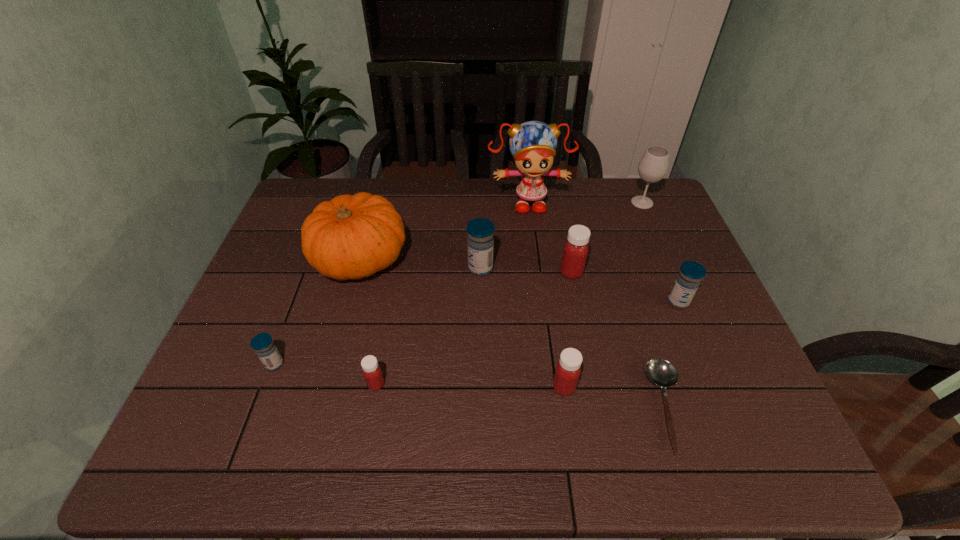
Locate an element on the screen. The image size is (960, 540). vacant area situated 0.060m on the back of the fourth medicine from right to left is located at coordinates (480, 245).

Locate an element on the screen. The image size is (960, 540). free point located on the front of the fifth medicine from left to right is located at coordinates (585, 341).

I want to click on blank area located 0.090m on the left of the fourth nearest medicine, so click(633, 301).

Locate an element on the screen. blank space located on the right of the third medicine from right to left is located at coordinates (719, 387).

The image size is (960, 540). Find the location of `vacant space located 0.300m on the right of the leftmost blue medicine`. vacant space located 0.300m on the right of the leftmost blue medicine is located at coordinates (413, 364).

Locate an element on the screen. The width and height of the screenshot is (960, 540). vacant space located 0.150m on the front of the second medicine from left to right is located at coordinates (362, 461).

This screenshot has height=540, width=960. What are the coordinates of `blank space located on the left of the gray ladle` in the screenshot? It's located at (493, 407).

Where is `doll that is positioned at the far edge`? doll that is positioned at the far edge is located at coordinates (533, 144).

The width and height of the screenshot is (960, 540). I want to click on wineglass that is at the far edge, so click(x=653, y=166).

At what (x,y) coordinates should I click in order to perform the action: click on object present at the near edge. Please return your answer as a coordinate pair (x, y). Looking at the image, I should click on (661, 372).